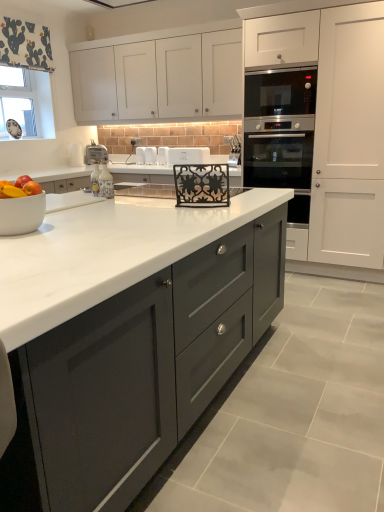
What do you see at coordinates (102, 182) in the screenshot? I see `porcelain bottle at center, the third appliance when ordered from left to right` at bounding box center [102, 182].

Identify the location of white matte cabinet at upper center, acting as the 2th cabinetry starting from the right. (160, 78).

What are the coordinates of `satin black oven at center-right, placed as the 2th appliance when sorted from right to left` in the screenshot? It's located at (234, 149).

Find the location of a particular element. The height and width of the screenshot is (512, 384). white matte oven at upper right, marked as the 3th cabinetry in a left-to-right arrangement is located at coordinates (336, 126).

At what (x,y) coordinates should I click in order to perform the action: click on porcelain bottle at center, the seventh appliance positioned from the back. Please return your answer as a coordinate pair (x, y). Looking at the image, I should click on (102, 182).

Is white fabric at upper left smaller than white glossy toaster at center, acting as the second appliance starting from the back?

Actually, white fabric at upper left might be larger than white glossy toaster at center, acting as the second appliance starting from the back.

Is white fabric at upper left in front of white glossy toaster at center, the 7th appliance from the right?

Yes, it is.

Does point (296, 112) lie in front of point (33, 135)?

Yes, it is.

Is satin black oven at upper right, which is counted as the 6th appliance, starting from the back, looking in the opposite direction of white fabric at upper left?

No, satin black oven at upper right, which is counted as the 6th appliance, starting from the back,'s orientation is not away from white fabric at upper left.

Can you confirm if satin black oven at upper right, the 8th appliance viewed from the left, is bigger than white fabric at upper left?

Indeed, satin black oven at upper right, the 8th appliance viewed from the left, has a larger size compared to white fabric at upper left.

Is satin black oven at upper right, the first appliance positioned from the right, at the left side of white fabric at upper left?

No, satin black oven at upper right, the first appliance positioned from the right, is not to the left of white fabric at upper left.

From the picture: From a real-world perspective, does white plastic toaster at center, placed as the third appliance when sorted from back to front, sit lower than white fabric at upper left?

Yes.

Considering the relative positions of white plastic toaster at center, the 5th appliance from the right, and white fabric at upper left in the image provided, is white plastic toaster at center, the 5th appliance from the right, to the left of white fabric at upper left from the viewer's perspective?

No, white plastic toaster at center, the 5th appliance from the right, is not to the left of white fabric at upper left.

How different are the orientations of white plastic toaster at center, placed as the third appliance when sorted from back to front, and white fabric at upper left in degrees?

88.6 degrees.

Considering the relative sizes of white plastic toaster at center, placed as the third appliance when sorted from back to front, and white fabric at upper left in the image provided, is white plastic toaster at center, placed as the third appliance when sorted from back to front, shorter than white fabric at upper left?

Correct, white plastic toaster at center, placed as the third appliance when sorted from back to front, is not as tall as white fabric at upper left.

Consider the image. Considering the relative sizes of white matte oven at upper right, positioned as the first cabinetry in right-to-left order, and white fabric at upper left in the image provided, is white matte oven at upper right, positioned as the first cabinetry in right-to-left order, shorter than white fabric at upper left?

No.

From a real-world perspective, between white matte oven at upper right, positioned as the first cabinetry in right-to-left order, and white fabric at upper left, who is vertically higher?

In real-world perspective, white fabric at upper left is above.

How many degrees apart are the facing directions of white matte oven at upper right, positioned as the first cabinetry in right-to-left order, and white fabric at upper left?

The angle between the facing direction of white matte oven at upper right, positioned as the first cabinetry in right-to-left order, and the facing direction of white fabric at upper left is 89.4 degrees.

From the image's perspective, is white matte oven at upper right, positioned as the first cabinetry in right-to-left order, below white fabric at upper left?

Indeed, from the image's perspective, white matte oven at upper right, positioned as the first cabinetry in right-to-left order, is shown beneath white fabric at upper left.

Is white plastic toaster at center, which is the eighth appliance in front-to-back order, turned away from white glossy toaster at center, which is counted as the fourth appliance, starting from the right?

No, white plastic toaster at center, which is the eighth appliance in front-to-back order, is not facing the opposite direction of white glossy toaster at center, which is counted as the fourth appliance, starting from the right.

Locate an element on the screen. The width and height of the screenshot is (384, 512). the 3rd appliance above when counting from the white glossy toaster at center, marked as the 5th appliance in a front-to-back arrangement (from the image's perspective) is located at coordinates (96, 154).

Which object is positioned more to the left, white plastic toaster at center, which appears as the eighth appliance when viewed from the right, or white glossy toaster at center, marked as the 5th appliance in a front-to-back arrangement?

white plastic toaster at center, which appears as the eighth appliance when viewed from the right.

Choose the correct answer: Is white plastic toaster at center, which appears as the eighth appliance when viewed from the right, inside white glossy toaster at center, acting as the fifth appliance starting from the left, or outside it?

white plastic toaster at center, which appears as the eighth appliance when viewed from the right, exists outside the volume of white glossy toaster at center, acting as the fifth appliance starting from the left.

How distant is satin black oven at center-right, positioned as the 5th appliance in back-to-front order, from stainless steel oven at right?

satin black oven at center-right, positioned as the 5th appliance in back-to-front order, is 22.86 inches from stainless steel oven at right.

Considering the relative sizes of satin black oven at center-right, marked as the 4th appliance in a front-to-back arrangement, and stainless steel oven at right in the image provided, is satin black oven at center-right, marked as the 4th appliance in a front-to-back arrangement, bigger than stainless steel oven at right?

No.

Could you tell me if satin black oven at center-right, placed as the 2th appliance when sorted from right to left, is turned towards stainless steel oven at right?

No, satin black oven at center-right, placed as the 2th appliance when sorted from right to left, does not turn towards stainless steel oven at right.

Looking at this image, who is shorter, satin black oven at center-right, positioned as the 5th appliance in back-to-front order, or stainless steel oven at right?

satin black oven at center-right, positioned as the 5th appliance in back-to-front order, is shorter.

Between white plastic toaster at center, which is counted as the 1th appliance, starting from the back, and white plastic toaster at center, placed as the third appliance when sorted from back to front, which one is positioned in front?

white plastic toaster at center, placed as the third appliance when sorted from back to front.

In terms of width, does white plastic toaster at center, which is counted as the 1th appliance, starting from the back, look wider or thinner when compared to white plastic toaster at center, the 5th appliance from the right?

Clearly, white plastic toaster at center, which is counted as the 1th appliance, starting from the back, has less width compared to white plastic toaster at center, the 5th appliance from the right.

Does white plastic toaster at center, the 1th appliance from the left, have a larger size compared to white plastic toaster at center, the 6th appliance viewed from the front?

Indeed, white plastic toaster at center, the 1th appliance from the left, has a larger size compared to white plastic toaster at center, the 6th appliance viewed from the front.

Looking at this image, from a real-world perspective, who is located lower, white plastic toaster at center, which appears as the eighth appliance when viewed from the right, or white plastic toaster at center, marked as the fourth appliance in a left-to-right arrangement?

white plastic toaster at center, marked as the fourth appliance in a left-to-right arrangement, from a real-world perspective.

The height and width of the screenshot is (512, 384). What are the coordinates of `window screen above the white glossy toaster at center, the 7th appliance from the right (from a real-world perspective)` in the screenshot? It's located at (28, 106).

Find the location of `window screen behind the satin black oven at upper right, the 8th appliance viewed from the left`. window screen behind the satin black oven at upper right, the 8th appliance viewed from the left is located at coordinates (28, 106).

Based on their spatial positions, is white matte cabinet at upper center, acting as the 2th cabinetry starting from the right, or stainless steel oven at right closer to white glossy toaster at center, which is counted as the 2th appliance, starting from the left?

stainless steel oven at right.

Based on their spatial positions, is satin black oven at center-right, which is the seventh appliance in left-to-right order, or satin black oven at upper right, the 8th appliance viewed from the left, further from white glossy toaster at center, acting as the second appliance starting from the back?

Among the two, satin black oven at upper right, the 8th appliance viewed from the left, is located further to white glossy toaster at center, acting as the second appliance starting from the back.

Based on their spatial positions, is white plastic toaster at center, the 1th appliance from the left, or satin black oven at upper right, the first appliance positioned from the right, closer to stainless steel oven at right?

Based on the image, satin black oven at upper right, the first appliance positioned from the right, appears to be nearer to stainless steel oven at right.

In the scene shown: Looking at the image, which one is located further to white fabric at upper left, white glossy toaster at center, the 7th appliance from the front, or satin black oven at upper right, marked as the third appliance in a front-to-back arrangement?

satin black oven at upper right, marked as the third appliance in a front-to-back arrangement, is further to white fabric at upper left.

Looking at the image, which one is located closer to white plastic toaster at center, which is counted as the 1th appliance, starting from the back, white glossy toaster at center, acting as the second appliance starting from the back, or metallic black decorative rack at center, which is the 6th appliance from left to right?

Based on the image, white glossy toaster at center, acting as the second appliance starting from the back, appears to be nearer to white plastic toaster at center, which is counted as the 1th appliance, starting from the back.

When comparing their distances from porcelain bottle at center, the second appliance in the front-to-back sequence, does matte gray cabinets at center, which ranks as the 1th cabinetry in left-to-right order, or white matte cabinet at upper center, arranged as the 2th cabinetry when viewed from the left, seem further?

Among the two, white matte cabinet at upper center, arranged as the 2th cabinetry when viewed from the left, is located further to porcelain bottle at center, the second appliance in the front-to-back sequence.

Which object lies further to the anchor point white fabric at upper left, matte gray cabinets at center, which ranks as the 1th cabinetry in left-to-right order, or red matte apple at left?

The object further to white fabric at upper left is matte gray cabinets at center, which ranks as the 1th cabinetry in left-to-right order.

From the image, which object appears to be nearer to white glossy toaster at center, acting as the fifth appliance starting from the left, red matte apple at left or white fabric at upper left?

The object closer to white glossy toaster at center, acting as the fifth appliance starting from the left, is red matte apple at left.

The height and width of the screenshot is (512, 384). I want to click on oven between red matte apple at left and white glossy toaster at center, the 7th appliance from the front, in the front-back direction, so click(281, 133).

Identify the location of oven positioned between white matte oven at upper right, positioned as the first cabinetry in right-to-left order, and satin black oven at center-right, placed as the 2th appliance when sorted from right to left, from near to far. The image size is (384, 512). (281, 133).

This screenshot has width=384, height=512. Find the location of `cabinetry situated between porcelain bottle at center, the third appliance when ordered from left to right, and satin black oven at upper right, the first appliance positioned from the right, from left to right`. cabinetry situated between porcelain bottle at center, the third appliance when ordered from left to right, and satin black oven at upper right, the first appliance positioned from the right, from left to right is located at coordinates (160, 78).

You are a GUI agent. You are given a task and a screenshot of the screen. Output one action in this format:
    pyautogui.click(x=<x>, y=<y>)
    Task: Click on the oven positioned between matte gray cabinets at center, which ranks as the 1th cabinetry in left-to-right order, and white plastic toaster at center, which is the eighth appliance in front-to-back order, from near to far
    
    Given the screenshot: What is the action you would take?
    pyautogui.click(x=281, y=133)